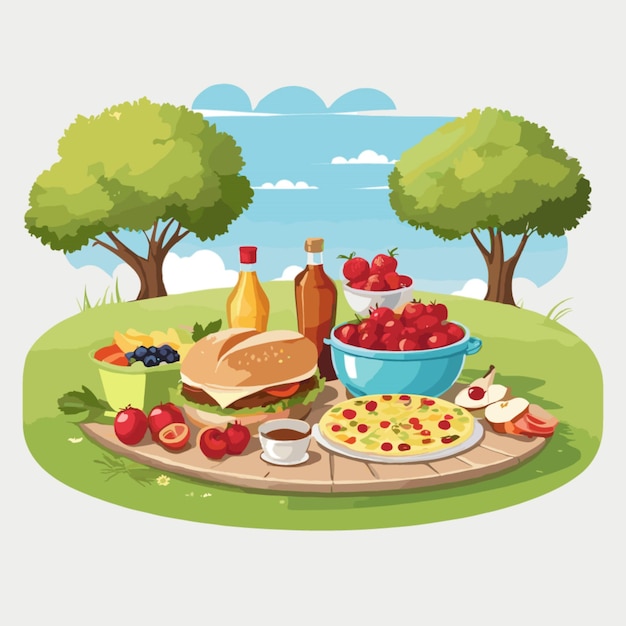
You are a GUI agent. You are given a task and a screenshot of the screen. Output one action in this format:
    pyautogui.click(x=<x>, y=<y>)
    Task: Click on the saucer
    
    Given the screenshot: What is the action you would take?
    pyautogui.click(x=302, y=459)